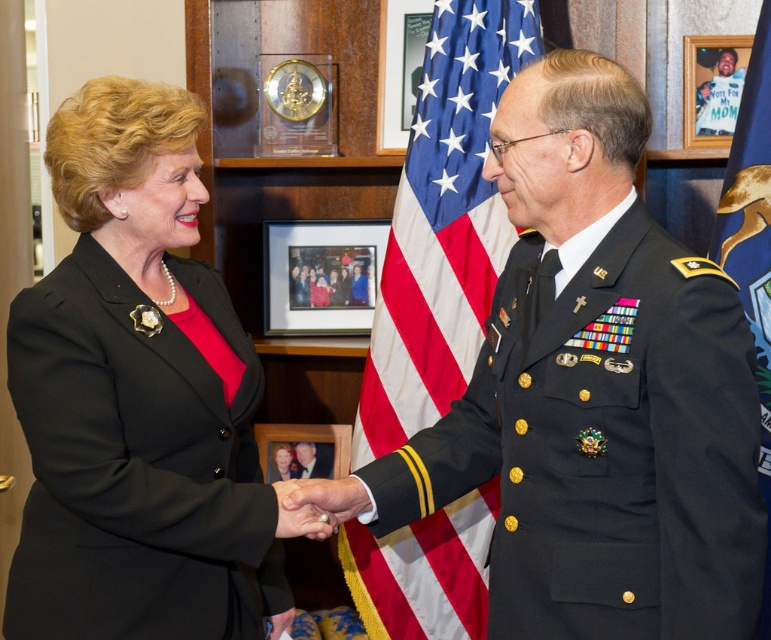
Question: From the image, what is the correct spatial relationship of black matte uniform at right in relation to wooden framed photo at center?

Choices:
 (A) above
 (B) below

Answer: (B)

Question: Does black matte suit at left appear over wooden framed photo at center?

Choices:
 (A) no
 (B) yes

Answer: (A)

Question: Which object appears closest to the camera in this image?

Choices:
 (A) black matte uniform at right
 (B) american flag at center
 (C) black matte suit at left

Answer: (A)

Question: Is black matte suit at left above wooden picture frame at upper right?

Choices:
 (A) no
 (B) yes

Answer: (A)

Question: Which point is farther from the camera taking this photo?

Choices:
 (A) (89, 211)
 (B) (675, 557)

Answer: (A)

Question: Which of these objects is positioned closest to the black matte uniform at right?

Choices:
 (A) wooden picture frame at upper right
 (B) blue fabric flag at right
 (C) wooden photo frame at center

Answer: (B)